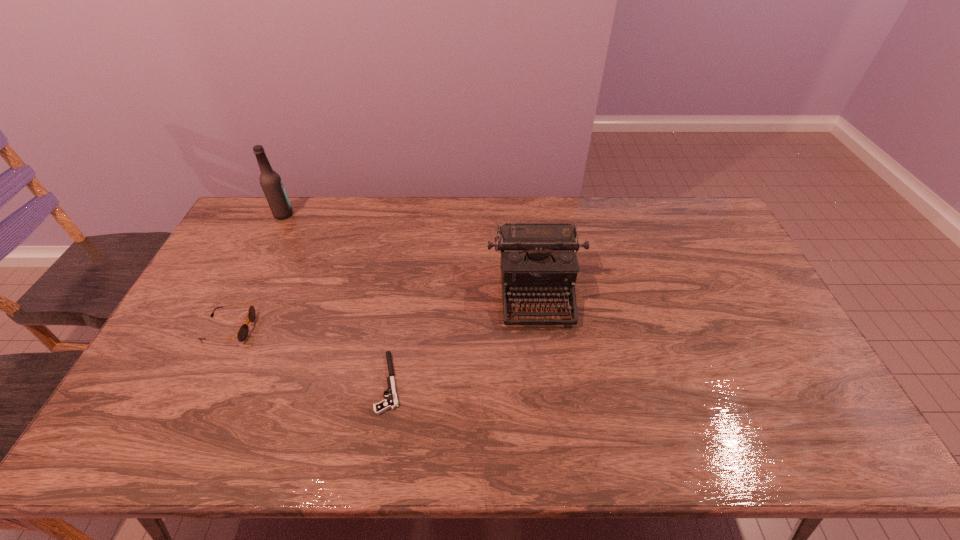
Where is `the farthest object`? This screenshot has height=540, width=960. the farthest object is located at coordinates (270, 181).

Find the location of a particular element. the tallest object is located at coordinates (270, 181).

At what (x,y) coordinates should I click in order to perform the action: click on the rightmost object. Please return your answer as a coordinate pair (x, y). Looking at the image, I should click on (538, 259).

Where is `typewriter`? typewriter is located at coordinates (538, 259).

The width and height of the screenshot is (960, 540). I want to click on sunglasses, so click(x=242, y=334).

Image resolution: width=960 pixels, height=540 pixels. Identify the location of pistol. [391, 402].

This screenshot has width=960, height=540. What are the coordinates of `the shortest object` in the screenshot? It's located at (391, 402).

I want to click on vacant space situated 0.160m on the label of the beer bottle, so click(336, 214).

Locate an element on the screen. Image resolution: width=960 pixels, height=540 pixels. blank area located 0.190m on the typing side of the third shortest object is located at coordinates (547, 386).

Where is `vacant point located on the front-facing side of the sunglasses`? This screenshot has height=540, width=960. vacant point located on the front-facing side of the sunglasses is located at coordinates (290, 328).